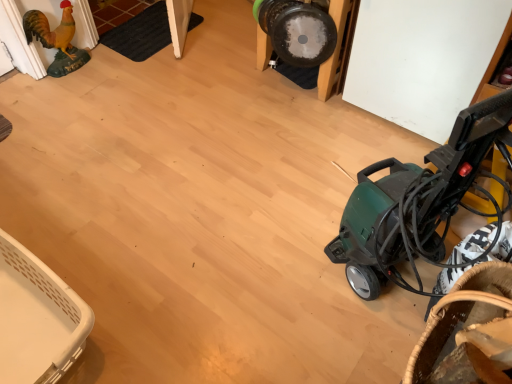
Find the location of a particular element. vacant space underneath golden matte chicken at left (from a real-world perspective) is located at coordinates (66, 71).